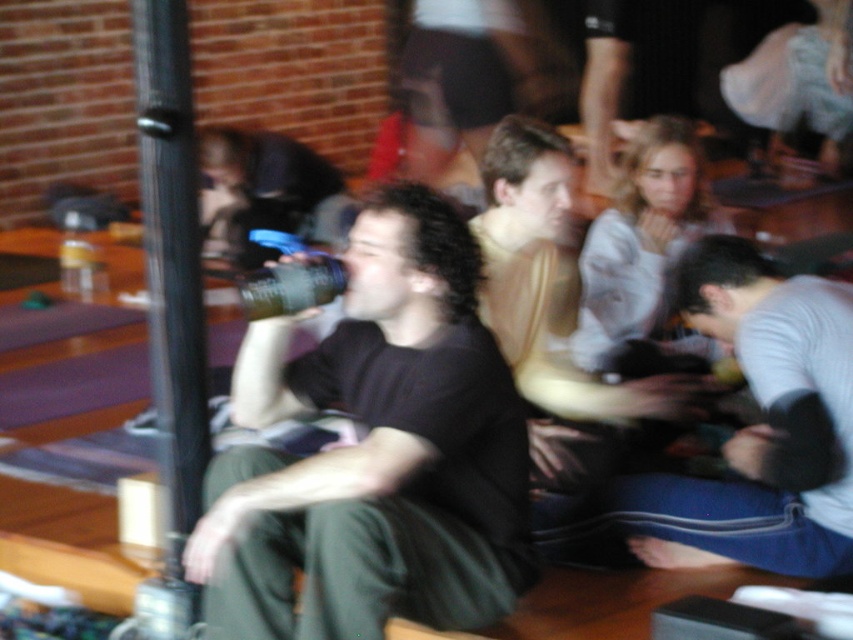
Question: Which object is farther from the camera taking this photo?

Choices:
 (A) black plastic pole at left
 (B) light brown leather jacket at center
 (C) black matte t-shirt at center
 (D) gray ribbed sweater at lower right

Answer: (B)

Question: Which point is farther to the camera?

Choices:
 (A) black plastic pole at left
 (B) black matte t-shirt at center

Answer: (A)

Question: Can you confirm if black matte t-shirt at center is smaller than gray ribbed sweater at lower right?

Choices:
 (A) no
 (B) yes

Answer: (A)

Question: In this image, where is light brown leather jacket at center located relative to black plastic pole at left?

Choices:
 (A) left
 (B) right

Answer: (B)

Question: Which point is farther to the camera?

Choices:
 (A) gray ribbed sweater at lower right
 (B) black matte t-shirt at center

Answer: (A)

Question: Where is black matte t-shirt at center located in relation to light brown leather jacket at center in the image?

Choices:
 (A) below
 (B) above

Answer: (A)